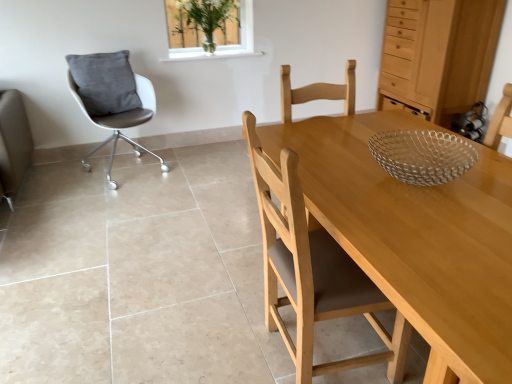
Question: Would you say light wood dresser at upper right is outside light brown wood chair at center, which is the second chair in back-to-front order?

Choices:
 (A) yes
 (B) no

Answer: (A)

Question: Considering the relative sizes of light wood dresser at upper right and light brown wood chair at center, which ranks as the first chair in front-to-back order, in the image provided, is light wood dresser at upper right thinner than light brown wood chair at center, which ranks as the first chair in front-to-back order,?

Choices:
 (A) no
 (B) yes

Answer: (A)

Question: Considering the relative sizes of light wood dresser at upper right and light brown wood chair at center, which ranks as the first chair in front-to-back order, in the image provided, is light wood dresser at upper right smaller than light brown wood chair at center, which ranks as the first chair in front-to-back order,?

Choices:
 (A) no
 (B) yes

Answer: (A)

Question: Is there a large distance between light wood dresser at upper right and light brown wood chair at center, positioned as the second chair in left-to-right order?

Choices:
 (A) yes
 (B) no

Answer: (A)

Question: Does light wood dresser at upper right lie behind light brown wood chair at center, which ranks as the first chair in front-to-back order?

Choices:
 (A) no
 (B) yes

Answer: (B)

Question: In the image, is clear glass vase at upper center positioned in front of or behind light brown wood chair at center, which is counted as the first chair, starting from the right?

Choices:
 (A) behind
 (B) front

Answer: (A)

Question: In terms of width, does clear glass vase at upper center look wider or thinner when compared to light brown wood chair at center, which is the second chair in back-to-front order?

Choices:
 (A) thin
 (B) wide

Answer: (A)

Question: From the image's perspective, is clear glass vase at upper center above or below light brown wood chair at center, which ranks as the first chair in front-to-back order?

Choices:
 (A) below
 (B) above

Answer: (B)

Question: From a real-world perspective, is clear glass vase at upper center physically located above or below light brown wood chair at center, positioned as the second chair in left-to-right order?

Choices:
 (A) below
 (B) above

Answer: (B)

Question: Considering the positions of white leather chair at left, which ranks as the second chair in right-to-left order, and gray velvety pillow at left in the image, is white leather chair at left, which ranks as the second chair in right-to-left order, bigger or smaller than gray velvety pillow at left?

Choices:
 (A) small
 (B) big

Answer: (B)

Question: From the image's perspective, relative to gray velvety pillow at left, is white leather chair at left, the 1th chair positioned from the left, above or below?

Choices:
 (A) above
 (B) below

Answer: (B)

Question: Is white leather chair at left, the first chair positioned from the back, taller or shorter than gray velvety pillow at left?

Choices:
 (A) tall
 (B) short

Answer: (A)

Question: Do you think white leather chair at left, acting as the 2th chair starting from the front, is within gray velvety pillow at left, or outside of it?

Choices:
 (A) inside
 (B) outside

Answer: (B)

Question: From the image's perspective, is light brown wood chair at center, positioned as the second chair in left-to-right order, above or below white leather chair at left, the 1th chair positioned from the left?

Choices:
 (A) above
 (B) below

Answer: (B)

Question: Is light brown wood chair at center, positioned as the second chair in left-to-right order, bigger or smaller than white leather chair at left, acting as the 2th chair starting from the front?

Choices:
 (A) big
 (B) small

Answer: (B)